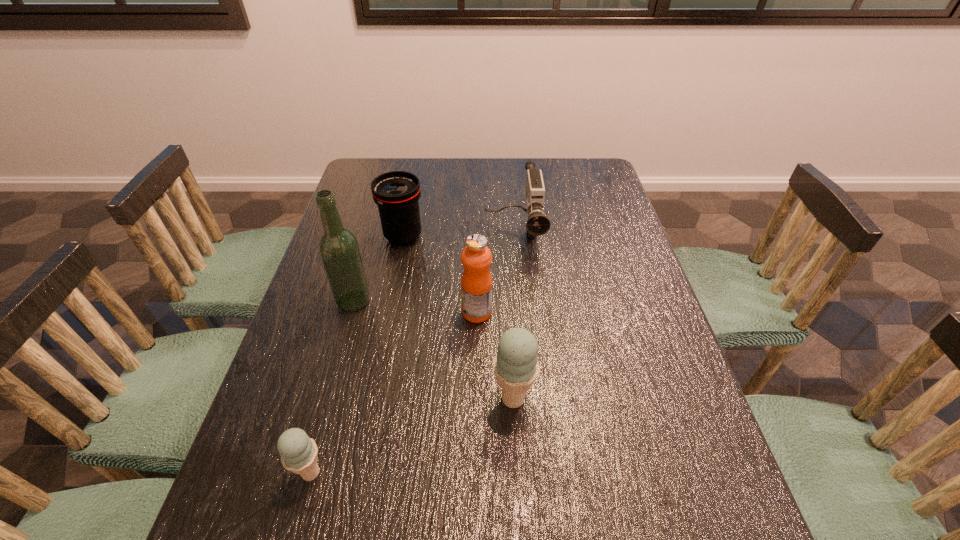
The image size is (960, 540). I want to click on the nearest object, so click(x=299, y=453).

You are a GUI agent. You are given a task and a screenshot of the screen. Output one action in this format:
    pyautogui.click(x=<x>, y=<y>)
    Task: Click on the left ice cream
    
    Given the screenshot: What is the action you would take?
    pyautogui.click(x=299, y=453)

Where is `the taller ice cream`? The image size is (960, 540). the taller ice cream is located at coordinates (516, 366).

This screenshot has width=960, height=540. Identify the location of the fifth farthest object. (516, 366).

Locate an element on the screen. The width and height of the screenshot is (960, 540). camcorder is located at coordinates (537, 224).

Locate an element on the screen. This screenshot has width=960, height=540. the tallest object is located at coordinates (338, 247).

Where is `telephoto lens`? Image resolution: width=960 pixels, height=540 pixels. telephoto lens is located at coordinates (396, 193).

Image resolution: width=960 pixels, height=540 pixels. I want to click on fruit juice, so coord(476,282).

What are the coordinates of `vacant space located on the back of the shortest object` in the screenshot? It's located at (344, 354).

You are a GUI agent. You are given a task and a screenshot of the screen. Output one action in this format:
    pyautogui.click(x=<x>, y=<y>)
    Task: Click on the vacant space located on the left of the fifth farthest object
    The image size is (960, 540).
    Given the screenshot: What is the action you would take?
    pyautogui.click(x=354, y=399)